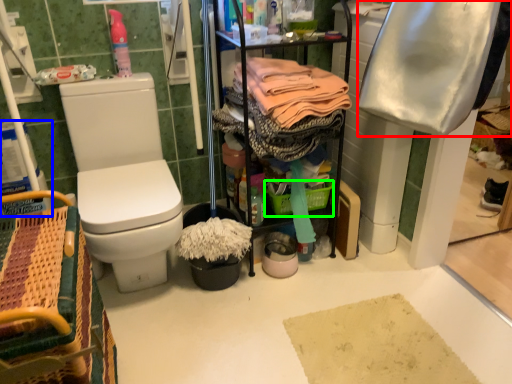
Question: Based on their relative distances, which object is farther from clothing (highlighted by a red box)? Choose from toilet paper (highlighted by a blue box) and basket (highlighted by a green box).

Choices:
 (A) toilet paper
 (B) basket

Answer: (A)